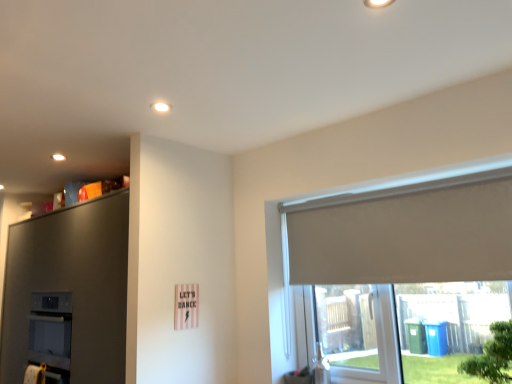
Question: Considering the positions of green leafy tree at lower right and matte gray dresser at upper left in the image, is green leafy tree at lower right taller or shorter than matte gray dresser at upper left?

Choices:
 (A) tall
 (B) short

Answer: (B)

Question: From a real-world perspective, is green leafy tree at lower right positioned above or below matte gray dresser at upper left?

Choices:
 (A) above
 (B) below

Answer: (B)

Question: Which of these objects is positioned farthest from the matte gray dresser at upper left?

Choices:
 (A) white roller blind at right
 (B) green leafy tree at lower right

Answer: (B)

Question: Which is nearer to the white roller blind at right?

Choices:
 (A) matte gray dresser at upper left
 (B) green leafy tree at lower right

Answer: (B)